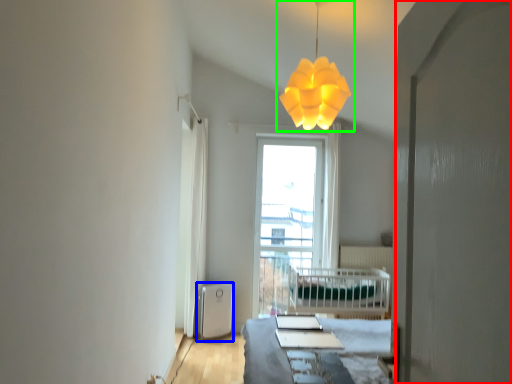
Question: Which object is the farthest from screen door (highlighted by a red box)? Choose among these: water heater (highlighted by a blue box) or lamp (highlighted by a green box).

Choices:
 (A) water heater
 (B) lamp

Answer: (A)